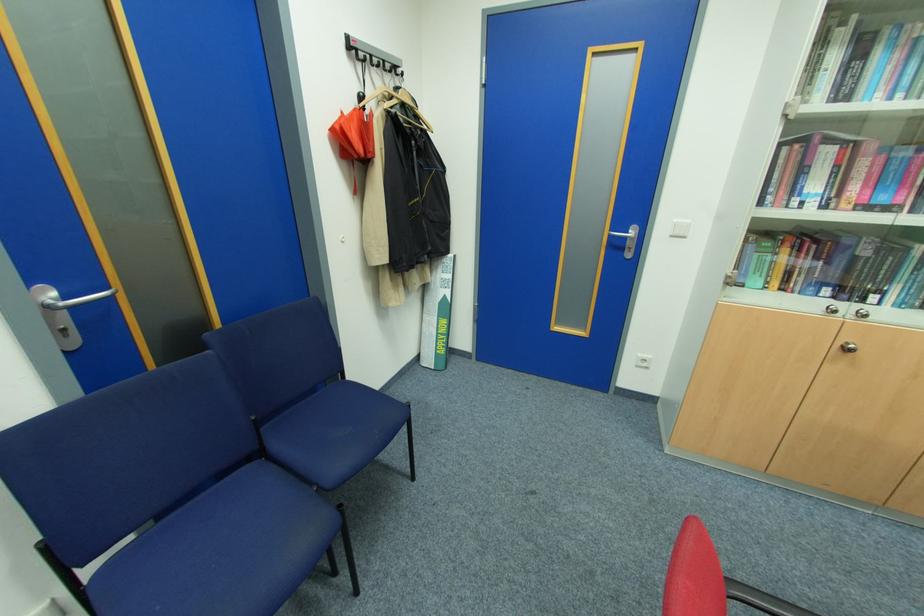
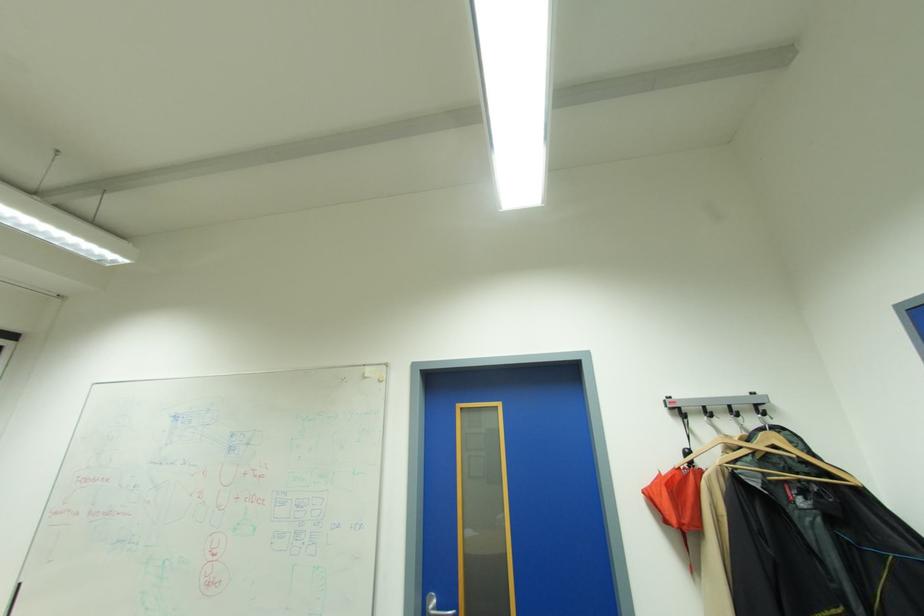
In the second image, find the point that corresponds to pixel 405 90 in the first image.

(764, 434)